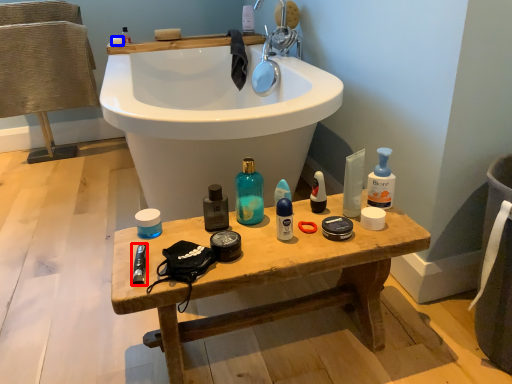
Question: Which object is closer to the camera taking this photo, personal care (highlighted by a red box) or soap (highlighted by a blue box)?

Choices:
 (A) personal care
 (B) soap

Answer: (A)